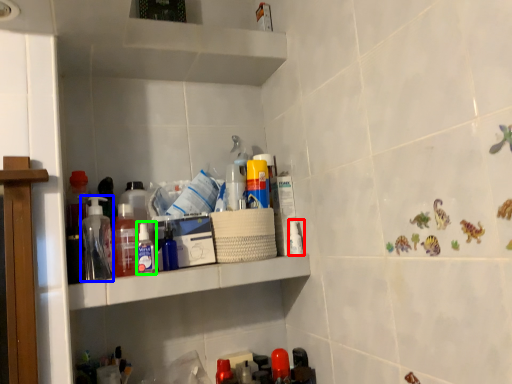
Question: Which object is the closest to the toiletry (highlighted by a red box)? Choose among these: bottle (highlighted by a blue box) or toiletry (highlighted by a green box).

Choices:
 (A) bottle
 (B) toiletry

Answer: (B)